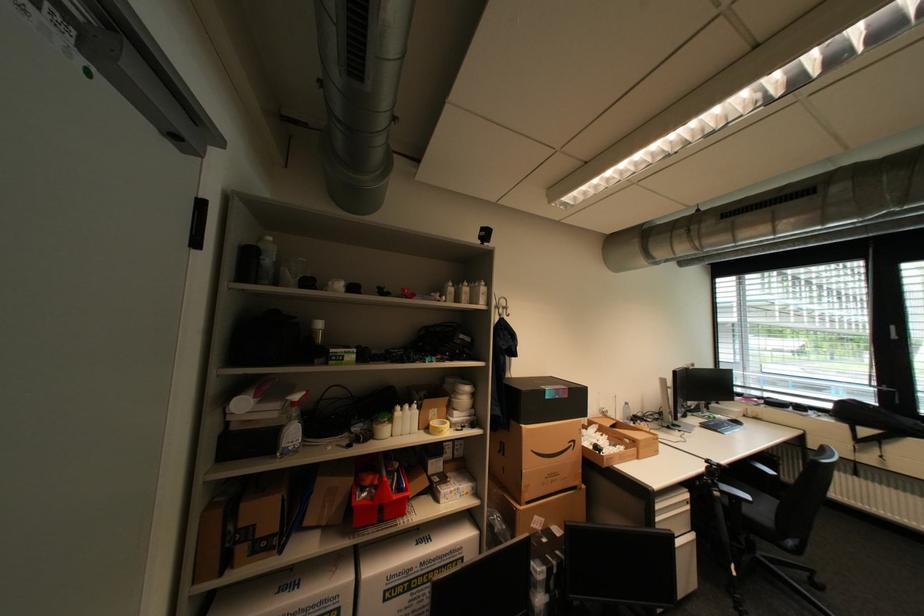
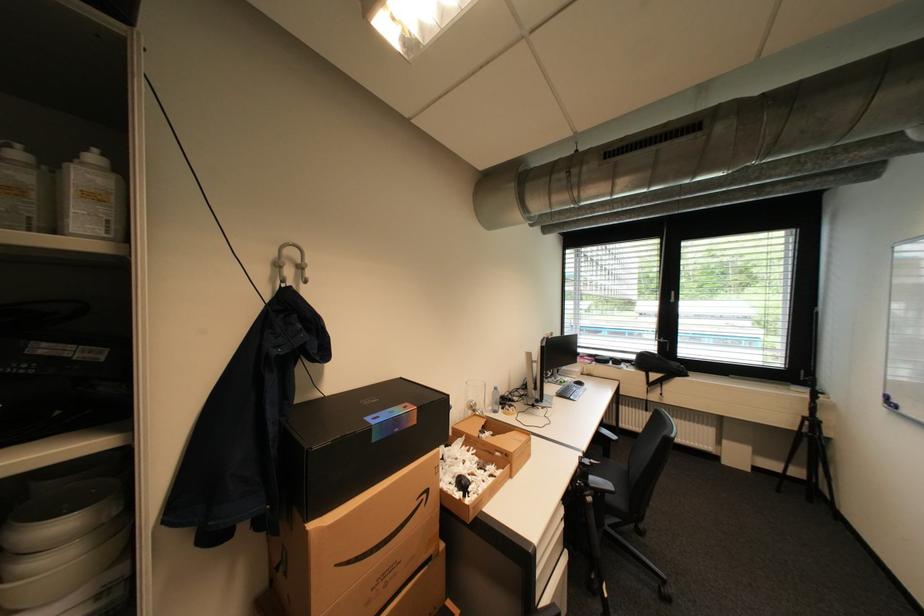
Locate, in the second image, the point that corresponds to point 893,387 in the first image.

(670, 339)